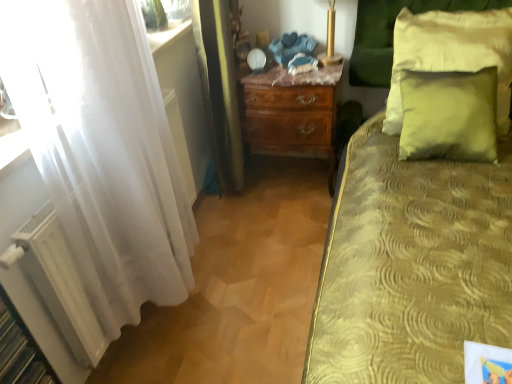
Where is `free point below mahogany wood nightstand at center (from a real-world perspective)`? This screenshot has height=384, width=512. free point below mahogany wood nightstand at center (from a real-world perspective) is located at coordinates (293, 182).